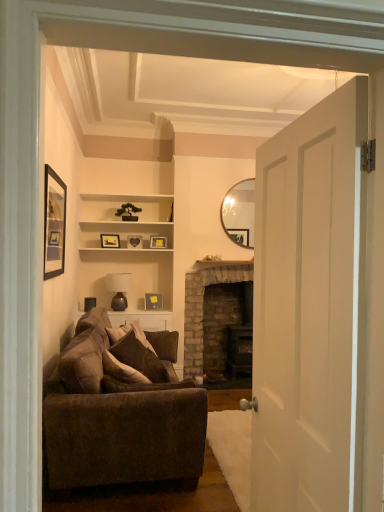
The width and height of the screenshot is (384, 512). I want to click on matte yellow picture frame at center, arranged as the fourth picture frame when viewed from the top, so (x=158, y=241).

Where is `white matte door at center`? This screenshot has width=384, height=512. white matte door at center is located at coordinates (310, 309).

Find the location of `black matte picture frame at upper left, the fifth picture frame in the bottom-to-top sequence`. black matte picture frame at upper left, the fifth picture frame in the bottom-to-top sequence is located at coordinates (54, 224).

In the scene shown: How far apart are wooden heart at center, placed as the second picture frame when sorted from top to bottom, and matte gold picture frame at upper center, the 5th picture frame viewed from the top?

A distance of 25.43 inches exists between wooden heart at center, placed as the second picture frame when sorted from top to bottom, and matte gold picture frame at upper center, the 5th picture frame viewed from the top.

Can you confirm if wooden heart at center, the third picture frame positioned from the back, is wider than matte gold picture frame at upper center, the 5th picture frame viewed from the top?

In fact, wooden heart at center, the third picture frame positioned from the back, might be narrower than matte gold picture frame at upper center, the 5th picture frame viewed from the top.

Is wooden heart at center, which is the 3th picture frame in front-to-back order, far away from matte gold picture frame at upper center, which is the 1th picture frame from back to front?

wooden heart at center, which is the 3th picture frame in front-to-back order, is near matte gold picture frame at upper center, which is the 1th picture frame from back to front, not far away.

Between wooden heart at center, placed as the second picture frame when sorted from top to bottom, and matte gold picture frame at upper center, the 5th picture frame viewed from the top, which one has more height?

With more height is matte gold picture frame at upper center, the 5th picture frame viewed from the top.

Consider the image. Is matte yellow picture frame at center, arranged as the fourth picture frame when viewed from the top, oriented towards white matte door at center?

Yes.

Considering the positions of points (161, 238) and (323, 225), is point (161, 238) closer to camera compared to point (323, 225)?

No, (161, 238) is further to viewer.

How distant is matte yellow picture frame at center, the 2th picture frame when ordered from back to front, from white matte door at center?

3.50 meters.

Does matte yellow picture frame at center, the 2th picture frame when ordered from back to front, have a larger size compared to white matte door at center?

Actually, matte yellow picture frame at center, the 2th picture frame when ordered from back to front, might be smaller than white matte door at center.

In the image, is white wood shelf at center on the left side or the right side of matte brown lamp at center?

Based on their positions, white wood shelf at center is located to the right of matte brown lamp at center.

In the scene shown: How much distance is there between white wood shelf at center and matte brown lamp at center?

A distance of 25.94 inches exists between white wood shelf at center and matte brown lamp at center.

Considering the sizes of white wood shelf at center and matte brown lamp at center in the image, is white wood shelf at center taller or shorter than matte brown lamp at center?

In the image, white wood shelf at center appears to be taller than matte brown lamp at center.

Which point is more forward, (98, 238) or (115, 282)?

The point (98, 238) is in front.

Would you say brown fabric couch at lower left is to the left or to the right of matte black picture frame at upper center, which appears as the 2th picture frame when viewed from the front, in the picture?

brown fabric couch at lower left is positioned on matte black picture frame at upper center, which appears as the 2th picture frame when viewed from the front,'s right side.

Is brown fabric couch at lower left facing towards matte black picture frame at upper center, which appears as the 2th picture frame when viewed from the front?

No, brown fabric couch at lower left is not facing towards matte black picture frame at upper center, which appears as the 2th picture frame when viewed from the front.

Does brown fabric couch at lower left lie in front of matte black picture frame at upper center, which appears as the 2th picture frame when viewed from the front?

Yes, the depth of brown fabric couch at lower left is less than that of matte black picture frame at upper center, which appears as the 2th picture frame when viewed from the front.

Considering the sizes of objects matte yellow picture frame at center, the 2th picture frame when ordered from back to front, and black matte picture frame at upper left, acting as the 1th picture frame starting from the front, in the image provided, who is bigger, matte yellow picture frame at center, the 2th picture frame when ordered from back to front, or black matte picture frame at upper left, acting as the 1th picture frame starting from the front,?

Bigger between the two is black matte picture frame at upper left, acting as the 1th picture frame starting from the front.

Considering the sizes of objects matte yellow picture frame at center, the 2th picture frame when ordered from back to front, and black matte picture frame at upper left, acting as the 1th picture frame starting from the front, in the image provided, who is thinner, matte yellow picture frame at center, the 2th picture frame when ordered from back to front, or black matte picture frame at upper left, acting as the 1th picture frame starting from the front,?

With smaller width is black matte picture frame at upper left, acting as the 1th picture frame starting from the front.

Which is closer, (x=163, y=242) or (x=45, y=243)?

The point (x=45, y=243) is closer.

From the image's perspective, is wooden heart at center, which is counted as the fourth picture frame, starting from the bottom, below matte black picture frame at upper center, which appears as the 2th picture frame when viewed from the front?

Incorrect, from the image's perspective, wooden heart at center, which is counted as the fourth picture frame, starting from the bottom, is higher than matte black picture frame at upper center, which appears as the 2th picture frame when viewed from the front.

Is point (141, 242) closer or farther from the camera than point (105, 242)?

Point (141, 242) is farther from the camera than point (105, 242).

From a real-world perspective, is wooden heart at center, which is counted as the fourth picture frame, starting from the bottom, positioned over matte black picture frame at upper center, which appears as the 2th picture frame when viewed from the front, based on gravity?

Correct, in the physical world, wooden heart at center, which is counted as the fourth picture frame, starting from the bottom, is higher than matte black picture frame at upper center, which appears as the 2th picture frame when viewed from the front.

How different are the orientations of wooden heart at center, the third picture frame positioned from the back, and matte black picture frame at upper center, which is the third picture frame in bottom-to-top order, in degrees?

The facing directions of wooden heart at center, the third picture frame positioned from the back, and matte black picture frame at upper center, which is the third picture frame in bottom-to-top order, are 19.7 degrees apart.

Does white matte door at center appear on the left side of brick fireplace at center?

Yes.

How different are the orientations of white matte door at center and brick fireplace at center in degrees?

The angular difference between white matte door at center and brick fireplace at center is 89.7 degrees.

Is point (281, 200) closer or farther from the camera than point (229, 269)?

Point (281, 200) is closer to the camera than point (229, 269).

From the image's perspective, between white matte door at center and brick fireplace at center, who is located below?

brick fireplace at center is shown below in the image.

You are a GUI agent. You are given a task and a screenshot of the screen. Output one action in this format:
    pyautogui.click(x=<x>, y=<y>)
    Task: Click on the 2nd picture frame behind the wooden heart at center, which is the 3th picture frame in front-to-back order
    This screenshot has height=512, width=384.
    Given the screenshot: What is the action you would take?
    (153, 301)

Which picture frame is the 1st one when counting from the left side of the white matte door at center? Please provide its 2D coordinates.

[(158, 241)]

Looking at the image, which one is located closer to brown suede pillow at center, matte brown lamp at center or matte yellow picture frame at center, the 4th picture frame from the front?

Among the two, matte brown lamp at center is located nearer to brown suede pillow at center.

Based on the photo, estimate the real-world distances between objects in this image. Which object is closer to brick fireplace at center, white wood shelf at center or brown fabric couch at lower left?

white wood shelf at center is positioned closer to the anchor brick fireplace at center.

Which object lies nearer to the anchor point matte brown lamp at center, matte gold picture frame at upper center, the 5th picture frame viewed from the top, or brick fireplace at center?

Based on the image, matte gold picture frame at upper center, the 5th picture frame viewed from the top, appears to be nearer to matte brown lamp at center.

In the scene shown: Looking at the image, which one is located closer to white matte door at center, matte black picture frame at upper center, marked as the fourth picture frame in a back-to-front arrangement, or matte gold picture frame at upper center, the 1th picture frame when ordered from bottom to top?

matte black picture frame at upper center, marked as the fourth picture frame in a back-to-front arrangement, is closer to white matte door at center.

In the scene shown: From the image, which object appears to be nearer to white matte door at center, matte brown lamp at center or black matte picture frame at upper left, the fifth picture frame in the bottom-to-top sequence?

black matte picture frame at upper left, the fifth picture frame in the bottom-to-top sequence, is closer to white matte door at center.

In the scene shown: Based on their spatial positions, is brown fabric couch at lower left or black matte picture frame at upper left, positioned as the 1th picture frame in top-to-bottom order, closer to white matte door at center?

brown fabric couch at lower left.

Considering their positions, is matte yellow picture frame at center, the 2th picture frame when ordered from back to front, positioned further to brown suede pillow at center than wooden heart at center, the third picture frame positioned from the back?

matte yellow picture frame at center, the 2th picture frame when ordered from back to front, is further to brown suede pillow at center.

Estimate the real-world distances between objects in this image. Which object is closer to matte gold picture frame at upper center, which is the 1th picture frame from back to front, brick fireplace at center or wooden heart at center, which is counted as the fourth picture frame, starting from the bottom?

brick fireplace at center is closer to matte gold picture frame at upper center, which is the 1th picture frame from back to front.

You are a GUI agent. You are given a task and a screenshot of the screen. Output one action in this format:
    pyautogui.click(x=<x>, y=<y>)
    Task: Click on the shelf between white matte door at center and wooden heart at center, the third picture frame positioned from the back, from front to back
    This screenshot has width=384, height=512.
    Given the screenshot: What is the action you would take?
    pyautogui.click(x=121, y=218)

Image resolution: width=384 pixels, height=512 pixels. I want to click on studio couch between white matte door at center and matte black picture frame at upper center, which is counted as the 3th picture frame, starting from the top, in the front-back direction, so click(121, 411).

I want to click on lamp between matte yellow picture frame at center, arranged as the fourth picture frame when viewed from the top, and matte gold picture frame at upper center, marked as the 5th picture frame in a front-to-back arrangement, from top to bottom, so click(118, 289).

Find the location of `shelf positioned between brown suede pillow at center and wooden heart at center, the third picture frame positioned from the back, from near to far`. shelf positioned between brown suede pillow at center and wooden heart at center, the third picture frame positioned from the back, from near to far is located at coordinates (121, 218).